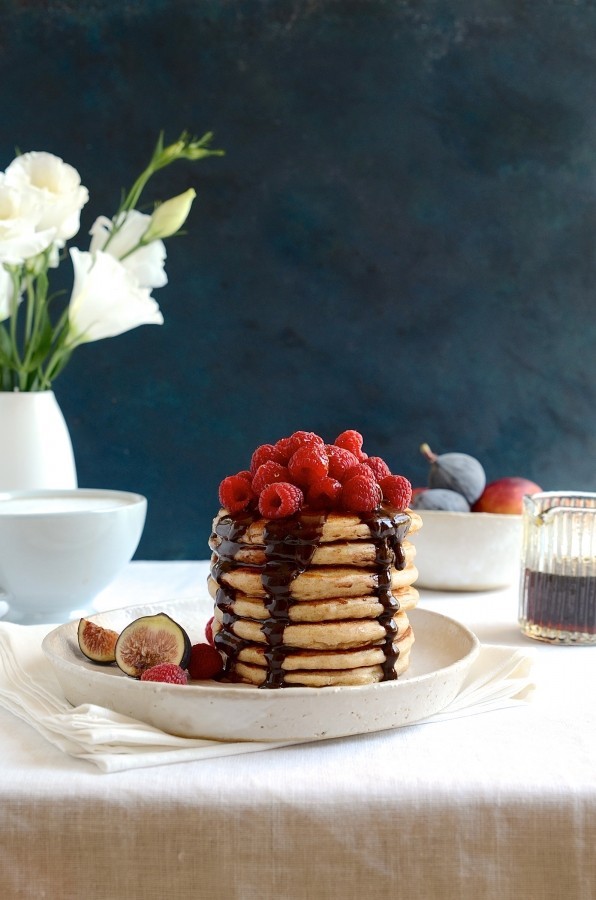
This screenshot has height=900, width=596. I want to click on vase, so click(x=24, y=418).